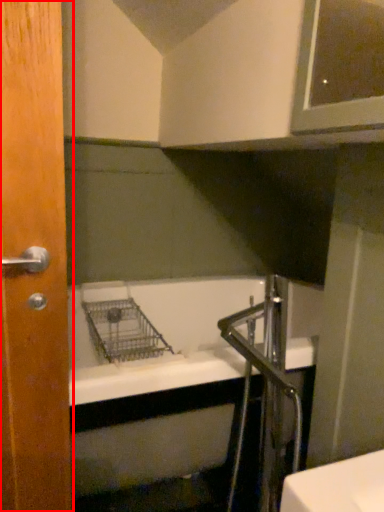
Question: From the image's perspective, considering the relative positions of door (annotated by the red box) and faucet in the image provided, where is door (annotated by the red box) located with respect to the staircase?

Choices:
 (A) below
 (B) above

Answer: (B)